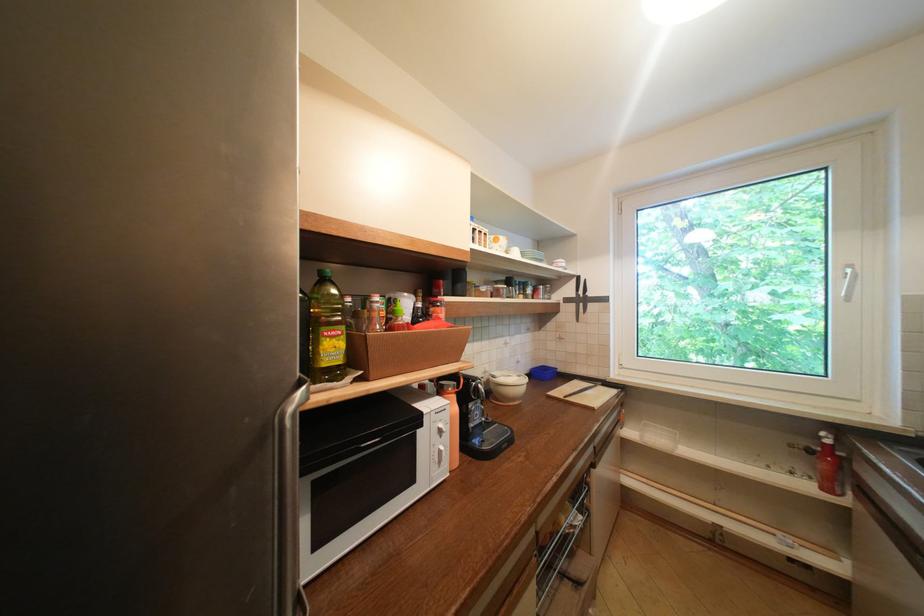
The width and height of the screenshot is (924, 616). I want to click on coffee machine lever, so click(488, 432).